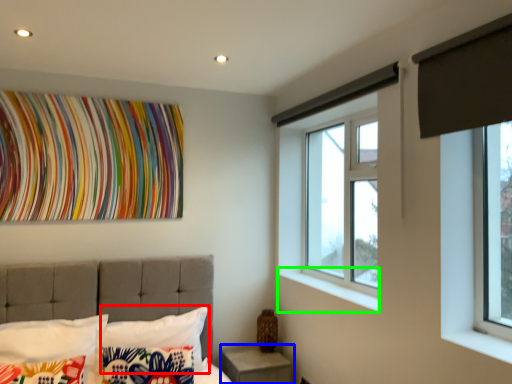
Question: Which object is the closest to the pillow (highlighted by a red box)? Choose among these: nightstand (highlighted by a blue box) or window sill (highlighted by a green box).

Choices:
 (A) nightstand
 (B) window sill

Answer: (A)